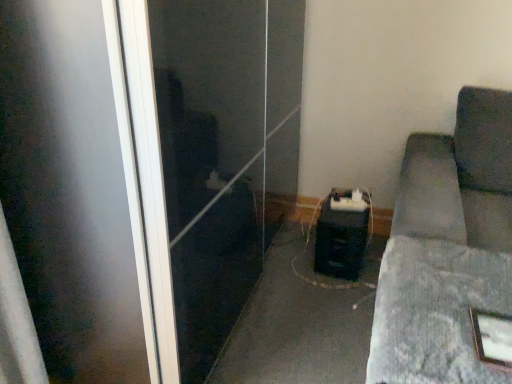
Question: Does gray fabric couch at lower right, which is the second concrete from back to front, have a smaller size compared to black plastic speaker at center, the 1th concrete from the back?

Choices:
 (A) no
 (B) yes

Answer: (B)

Question: Can you confirm if gray fabric couch at lower right, the 1th concrete positioned from the front, is shorter than black plastic speaker at center, the 2th concrete viewed from the front?

Choices:
 (A) no
 (B) yes

Answer: (A)

Question: Is the position of gray fabric couch at lower right, the 1th concrete positioned from the front, more distant than that of black plastic speaker at center, the 2th concrete viewed from the front?

Choices:
 (A) no
 (B) yes

Answer: (A)

Question: Considering the relative sizes of gray fabric couch at lower right, which is the second concrete from back to front, and black plastic speaker at center, the 2th concrete viewed from the front, in the image provided, is gray fabric couch at lower right, which is the second concrete from back to front, thinner than black plastic speaker at center, the 2th concrete viewed from the front,?

Choices:
 (A) no
 (B) yes

Answer: (B)

Question: Is gray fabric couch at lower right, the 1th concrete positioned from the front, not within black plastic speaker at center, the 1th concrete from the back?

Choices:
 (A) yes
 (B) no

Answer: (A)

Question: Is dark gray fabric couch at right taller or shorter than gray fabric couch at lower right, which is the second concrete from back to front?

Choices:
 (A) tall
 (B) short

Answer: (A)

Question: Does point (450, 160) appear closer or farther from the camera than point (443, 286)?

Choices:
 (A) closer
 (B) farther

Answer: (B)

Question: Is dark gray fabric couch at right wider or thinner than gray fabric couch at lower right, which is the second concrete from back to front?

Choices:
 (A) thin
 (B) wide

Answer: (B)

Question: Is dark gray fabric couch at right spatially inside gray fabric couch at lower right, which is the second concrete from back to front, or outside of it?

Choices:
 (A) outside
 (B) inside

Answer: (A)

Question: Considering the positions of wooden picture frame at lower right and black plastic speaker at center, the 2th concrete viewed from the front, in the image, is wooden picture frame at lower right bigger or smaller than black plastic speaker at center, the 2th concrete viewed from the front,?

Choices:
 (A) small
 (B) big

Answer: (A)

Question: In the image, is wooden picture frame at lower right on the left side or the right side of black plastic speaker at center, the 2th concrete viewed from the front?

Choices:
 (A) left
 (B) right

Answer: (B)

Question: From the image's perspective, relative to black plastic speaker at center, the 1th concrete from the back, is wooden picture frame at lower right above or below?

Choices:
 (A) below
 (B) above

Answer: (B)

Question: From a real-world perspective, is wooden picture frame at lower right positioned above or below black plastic speaker at center, the 2th concrete viewed from the front?

Choices:
 (A) above
 (B) below

Answer: (A)

Question: Would you say black plastic speaker at center, the 1th concrete from the back, is inside or outside transparent glass screen door at center?

Choices:
 (A) outside
 (B) inside

Answer: (A)

Question: From their relative heights in the image, would you say black plastic speaker at center, the 2th concrete viewed from the front, is taller or shorter than transparent glass screen door at center?

Choices:
 (A) short
 (B) tall

Answer: (A)